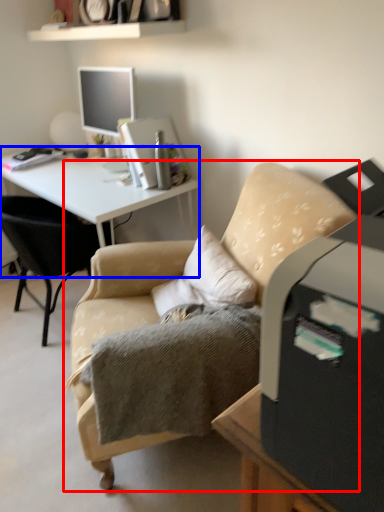
Question: Among these objects, which one is farthest to the camera, chair (highlighted by a red box) or desk (highlighted by a blue box)?

Choices:
 (A) chair
 (B) desk

Answer: (B)